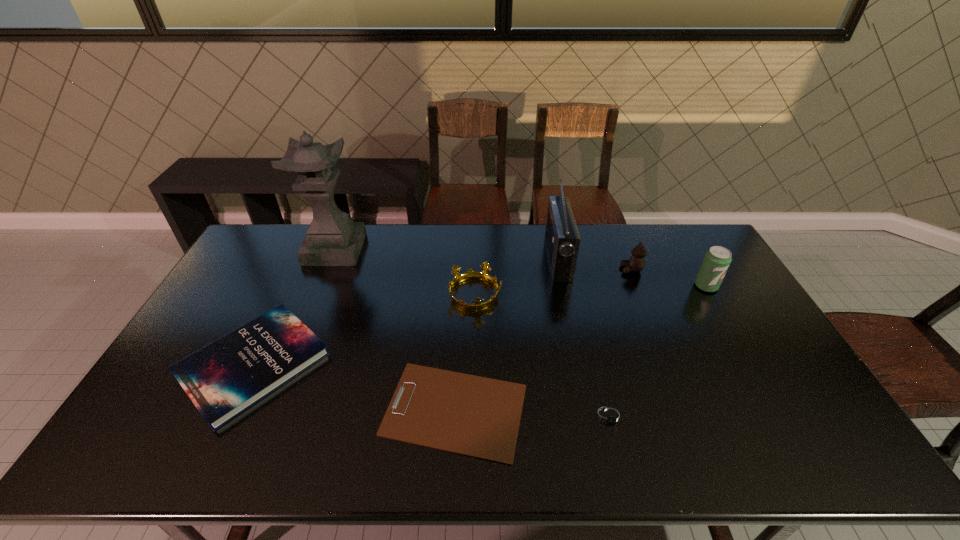
You are a GUI agent. You are given a task and a screenshot of the screen. Output one action in this format:
    pyautogui.click(x=<x>, y=<y>)
    Task: Click on the vacant space located on the back of the clipboard
    The width and height of the screenshot is (960, 540).
    Given the screenshot: What is the action you would take?
    pyautogui.click(x=459, y=330)

Where is `sculpture that is at the far edge`? Image resolution: width=960 pixels, height=540 pixels. sculpture that is at the far edge is located at coordinates (333, 239).

The image size is (960, 540). In order to click on radio receiver located in the far edge section of the desktop in this screenshot , I will do `click(562, 238)`.

Locate an element on the screen. This screenshot has width=960, height=540. teddy bear that is positioned at the far edge is located at coordinates (636, 263).

This screenshot has width=960, height=540. Find the location of `watch at the near edge`. watch at the near edge is located at coordinates (609, 416).

The image size is (960, 540). In order to click on clipboard present at the near edge in this screenshot , I will do `click(475, 416)`.

Where is `object that is at the left edge`? This screenshot has height=540, width=960. object that is at the left edge is located at coordinates (223, 379).

This screenshot has width=960, height=540. Find the location of `object present at the right edge`. object present at the right edge is located at coordinates (717, 259).

In the image, there is a desktop. At what (x,y) coordinates should I click in order to perform the action: click on vacant region at the far edge. Please return your answer as a coordinate pair (x, y). The height and width of the screenshot is (540, 960). Looking at the image, I should click on (530, 227).

Find the location of a particular element. This screenshot has width=960, height=540. vacant space at the near edge of the desktop is located at coordinates (725, 448).